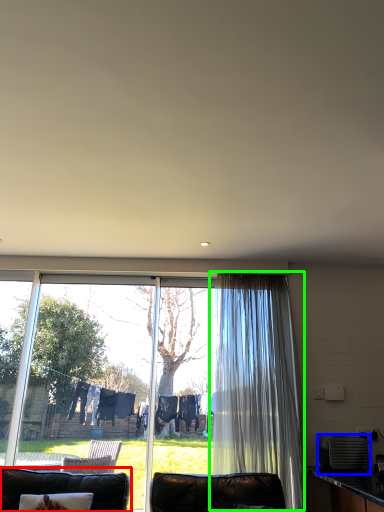
Question: Which object is the closest to the furniture (highlighted by a red box)? Choose among these: appliance (highlighted by a blue box) or curtain (highlighted by a green box).

Choices:
 (A) appliance
 (B) curtain

Answer: (B)